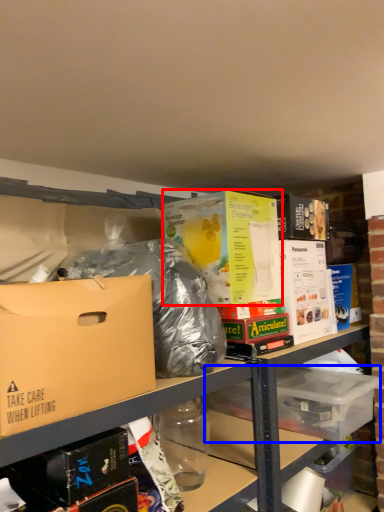
Question: Which of the following is the farthest to the observer, box (highlighted by a red box) or storage box (highlighted by a blue box)?

Choices:
 (A) box
 (B) storage box

Answer: (B)